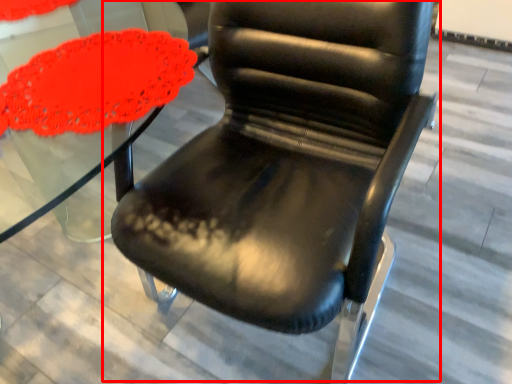
Question: From the image's perspective, where is chair (annotated by the red box) located in relation to round table in the image?

Choices:
 (A) above
 (B) below

Answer: (B)